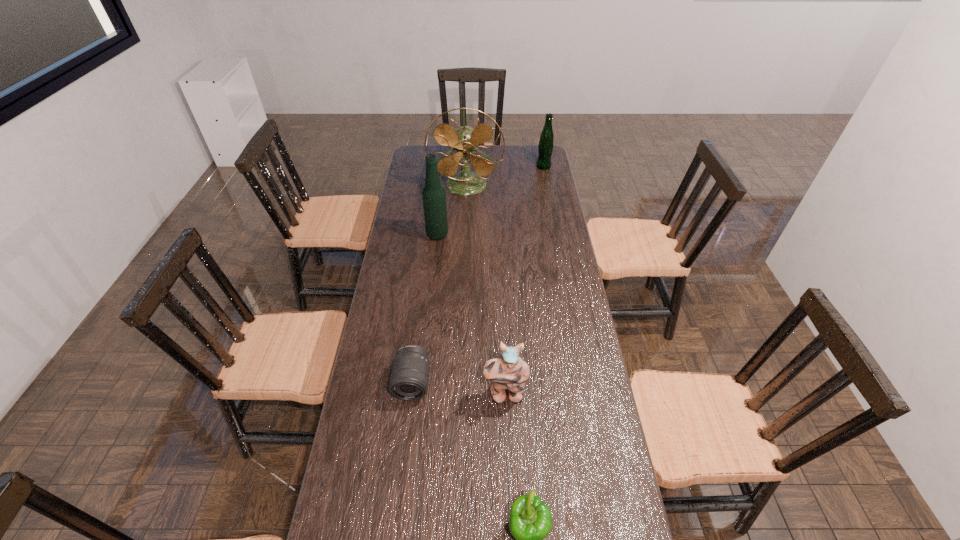
Identify the location of free space at the far right corner. (534, 151).

The width and height of the screenshot is (960, 540). What are the coordinates of `vacant region between the second farthest object and the figurine` in the screenshot? It's located at (486, 290).

At what (x,y) coordinates should I click in order to perform the action: click on vacant space in between the telephoto lens and the farthest object. Please return your answer as a coordinate pair (x, y). Looking at the image, I should click on point(478,274).

Locate an element on the screen. The height and width of the screenshot is (540, 960). free space between the figurine and the alcohol is located at coordinates (471, 315).

In order to click on free spot between the rightmost object and the fan in this screenshot , I will do `click(505, 176)`.

Identify the location of empty location between the fan and the alcohol. (452, 210).

Where is `vacant area between the farthest object and the shortest object`? The height and width of the screenshot is (540, 960). vacant area between the farthest object and the shortest object is located at coordinates (478, 274).

Locate an element on the screen. free point between the fan and the alcohol is located at coordinates (452, 210).

At what (x,y) coordinates should I click in order to perform the action: click on empty space between the figurine and the fourth nearest object. Please return your answer as a coordinate pair (x, y). The height and width of the screenshot is (540, 960). Looking at the image, I should click on (471, 315).

Where is `free area in between the fourth nearest object and the shortest object`? This screenshot has height=540, width=960. free area in between the fourth nearest object and the shortest object is located at coordinates (425, 308).